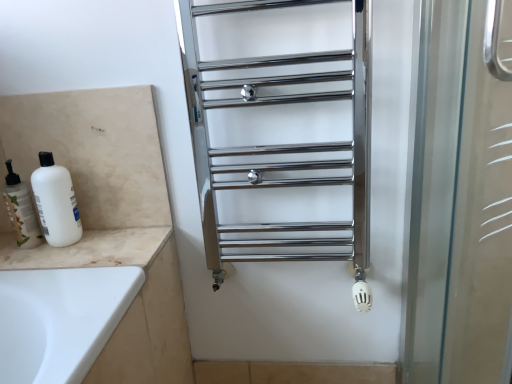
In order to click on vacant area that is situated to the right of white matte bottle at left in this screenshot , I will do (x=96, y=244).